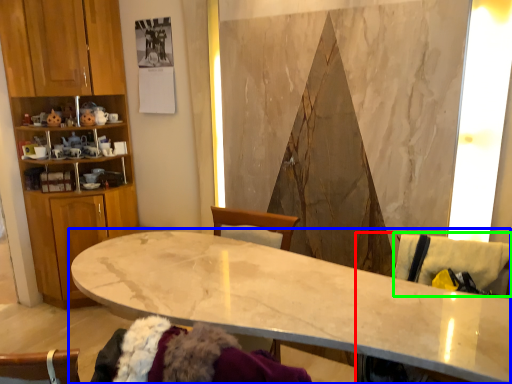
Question: Which is nearer to the swivel chair (highlighted by a red box)? countertop (highlighted by a blue box) or swivel chair (highlighted by a green box).

Choices:
 (A) countertop
 (B) swivel chair

Answer: (A)